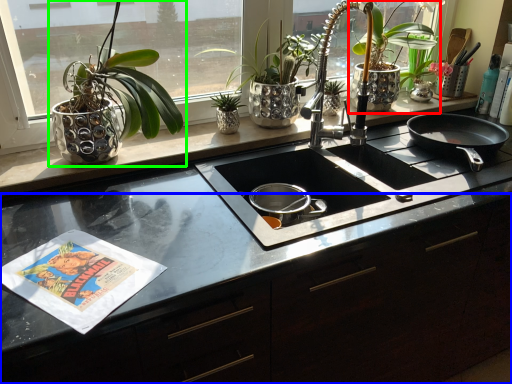
Question: Considering the real-world distances, which object is closest to houseplant (highlighted by a red box)? counter (highlighted by a blue box) or houseplant (highlighted by a green box).

Choices:
 (A) counter
 (B) houseplant

Answer: (A)